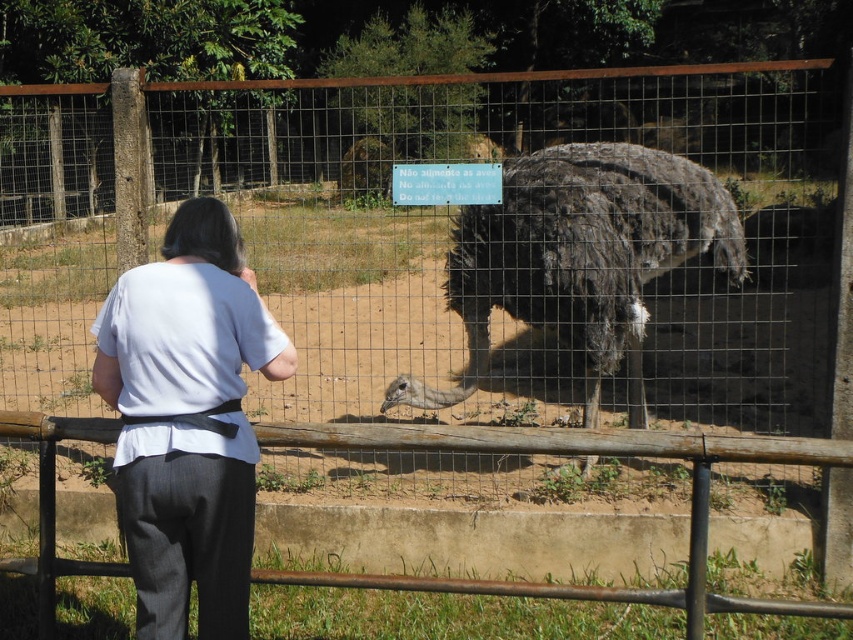
Question: Which of these objects is positioned farthest from the dark brown feathered ostrich at center?

Choices:
 (A) white fabric at center
 (B) rusty metal rail at lower center

Answer: (A)

Question: Is white fabric at center wider than dark brown feathered ostrich at center?

Choices:
 (A) yes
 (B) no

Answer: (B)

Question: Is white fabric at center bigger than rusty metal rail at lower center?

Choices:
 (A) no
 (B) yes

Answer: (A)

Question: Among these points, which one is nearest to the camera?

Choices:
 (A) (206, 358)
 (B) (622, 449)

Answer: (A)

Question: Can you confirm if white fabric at center is positioned above rusty metal rail at lower center?

Choices:
 (A) yes
 (B) no

Answer: (A)

Question: Among these points, which one is farthest from the camera?

Choices:
 (A) (509, 237)
 (B) (302, 429)
 (C) (178, 221)

Answer: (A)